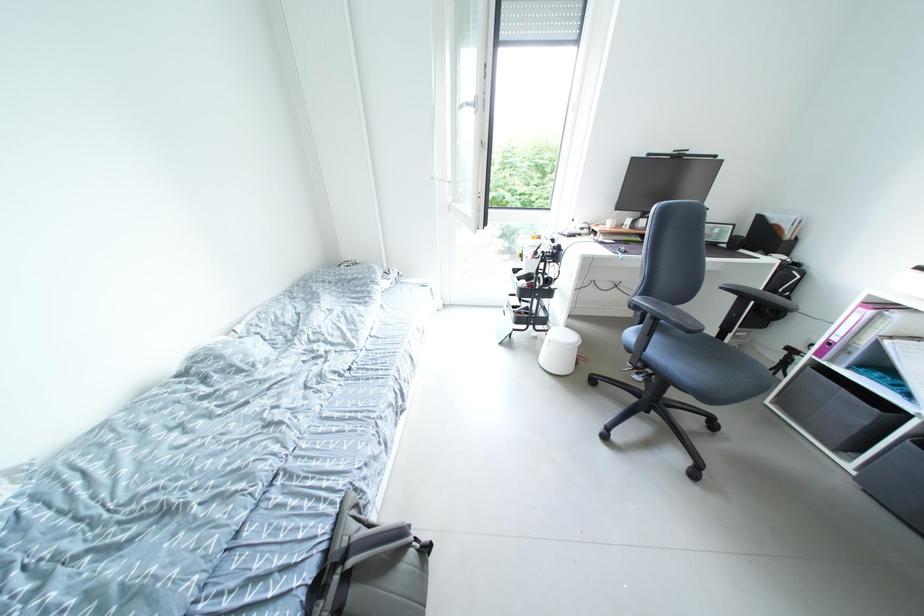
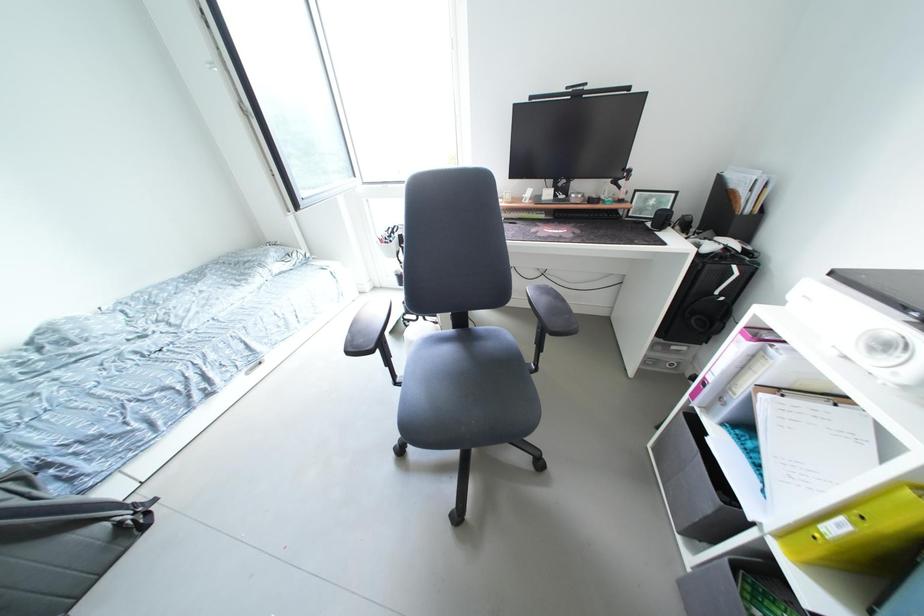
Question: What movement of the cameraman would produce the second image?

Choices:
 (A) Left
 (B) Right
 (C) Forward
 (D) Backward

Answer: (B)